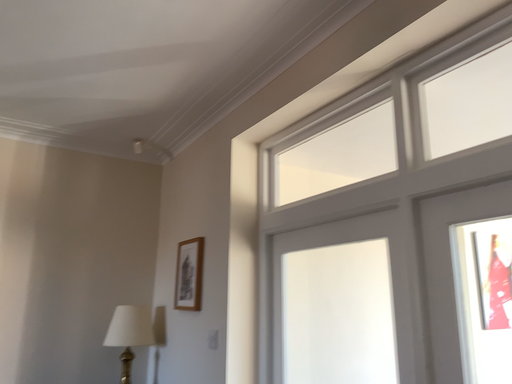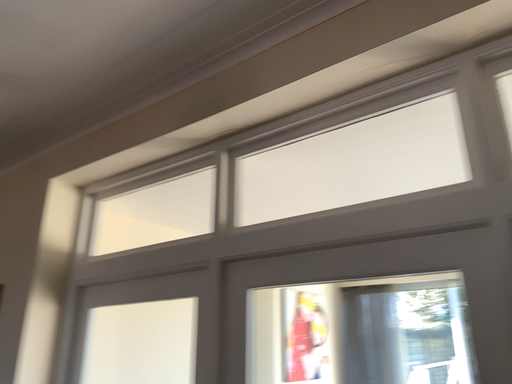
Question: How did the camera likely rotate when shooting the video?

Choices:
 (A) rotated left
 (B) rotated right

Answer: (B)